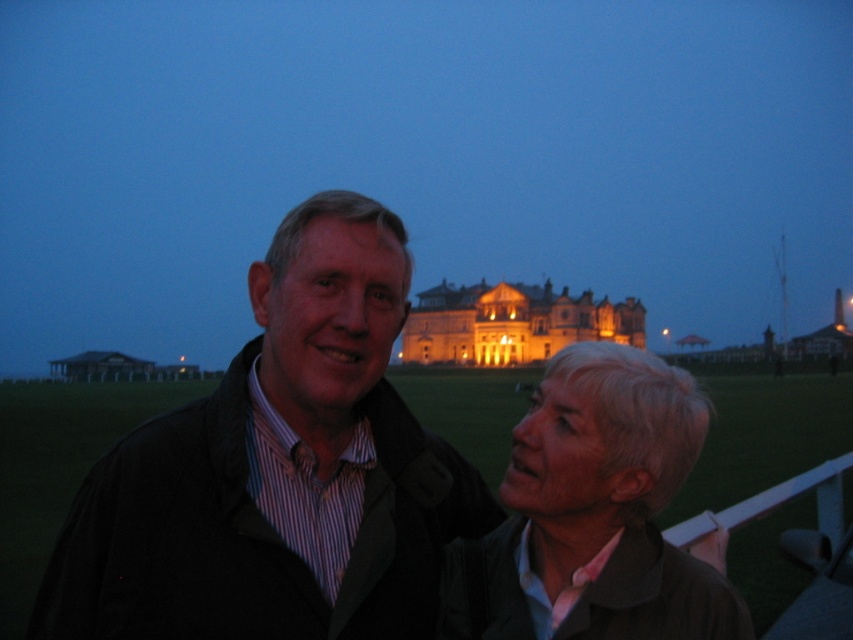
Question: From the image, what is the correct spatial relationship of matte black jacket at center in relation to matte brown jacket at center?

Choices:
 (A) above
 (B) below

Answer: (A)

Question: Which point is closer to the camera taking this photo?

Choices:
 (A) (563, 548)
 (B) (612, 333)

Answer: (A)

Question: Which of these objects is positioned farthest from the matte brown jacket at center?

Choices:
 (A) golden illuminated building at center
 (B) matte black jacket at center

Answer: (A)

Question: Does matte brown jacket at center lie behind golden illuminated building at center?

Choices:
 (A) no
 (B) yes

Answer: (A)

Question: From the image, what is the correct spatial relationship of matte brown jacket at center in relation to golden illuminated building at center?

Choices:
 (A) left
 (B) right

Answer: (B)

Question: Which point is closer to the camera?

Choices:
 (A) matte black jacket at center
 (B) golden illuminated building at center

Answer: (A)